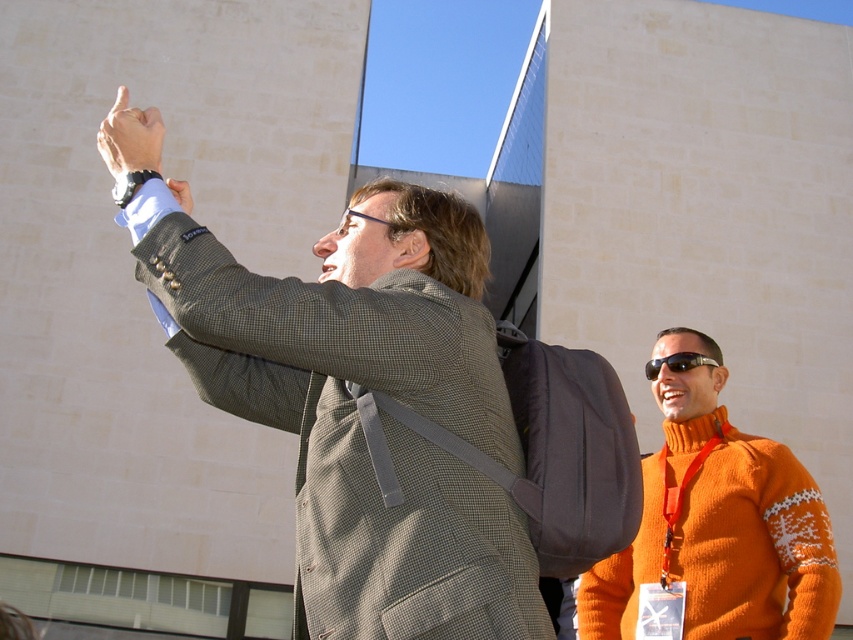
Question: Does matte gray blazer at upper left appear on the left side of black plastic sunglasses at upper right?

Choices:
 (A) yes
 (B) no

Answer: (A)

Question: Can you confirm if matte gray blazer at upper left is bigger than matte black wristwatch at upper left?

Choices:
 (A) yes
 (B) no

Answer: (A)

Question: Is orange knitted sweater at right wider than matte black wristwatch at upper left?

Choices:
 (A) yes
 (B) no

Answer: (A)

Question: Which of the following is the closest to the observer?

Choices:
 (A) black plastic sunglasses at upper right
 (B) matte gray blazer at upper left
 (C) orange knitted sweater at right

Answer: (B)

Question: Which of the following is the farthest from the observer?

Choices:
 (A) matte black wristwatch at upper left
 (B) matte gray blazer at upper left
 (C) black plastic sunglasses at upper right

Answer: (C)

Question: Estimate the real-world distances between objects in this image. Which object is farther from the black plastic sunglasses at upper right?

Choices:
 (A) matte gray blazer at upper left
 (B) matte black wristwatch at upper left

Answer: (B)